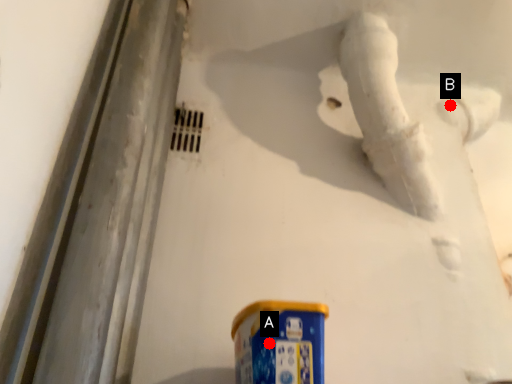
Question: Two points are circled on the image, labeled by A and B beside each circle. Which point is closer to the camera?

Choices:
 (A) A is closer
 (B) B is closer

Answer: (A)